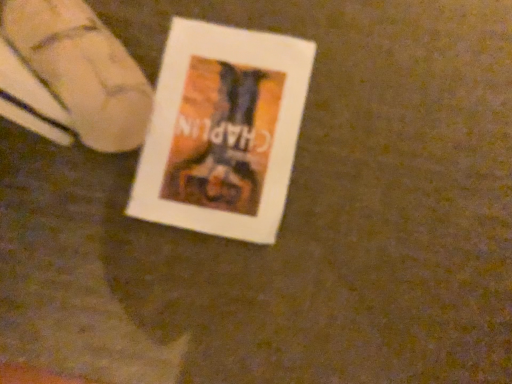
Identify the location of white fabric shoe at upper left. (82, 69).

The width and height of the screenshot is (512, 384). What do you see at coordinates (82, 69) in the screenshot?
I see `white fabric shoe at upper left` at bounding box center [82, 69].

The width and height of the screenshot is (512, 384). In order to click on white fabric shoe at upper left in this screenshot , I will do `click(82, 69)`.